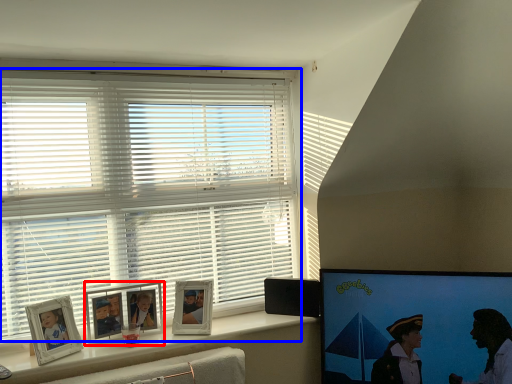
Question: Which point is further to the camera, picture frame (highlighted by a red box) or window blind (highlighted by a blue box)?

Choices:
 (A) picture frame
 (B) window blind

Answer: (A)